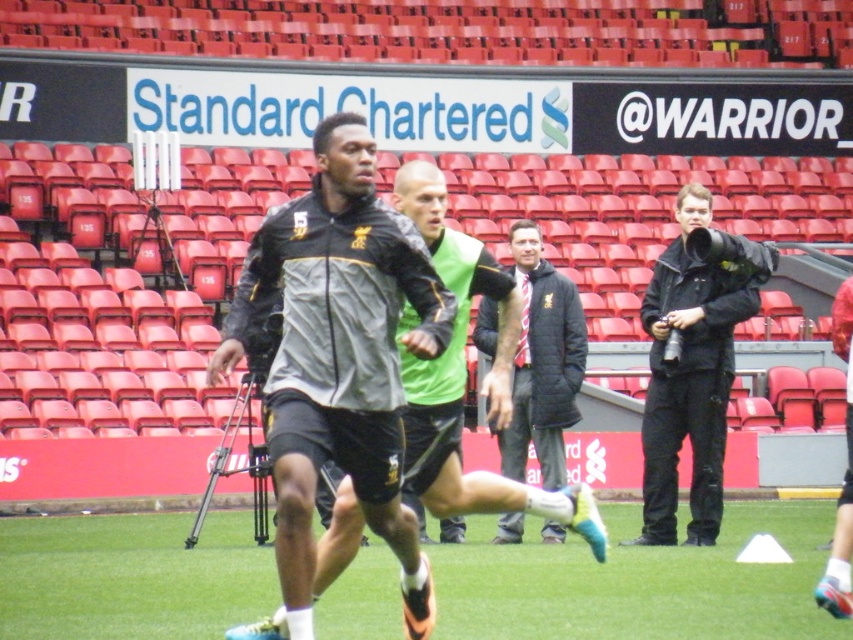
Who is taller, black leather jacket at right or green matte vest at center?

green matte vest at center is taller.

Is black leather jacket at right to the left of green matte vest at center from the viewer's perspective?

In fact, black leather jacket at right is to the right of green matte vest at center.

I want to click on black leather jacket at right, so click(x=689, y=378).

Between green grass at center and green matte vest at center, which one has more height?

green matte vest at center

Is green grass at center thinner than green matte vest at center?

No, green grass at center is not thinner than green matte vest at center.

At what (x,y) coordinates should I click in order to perform the action: click on green grass at center. Please return your answer as a coordinate pair (x, y). Looking at the image, I should click on (640, 582).

Who is taller, dark gray jacket at center or green matte vest at center?

green matte vest at center is taller.

Describe the element at coordinates (543, 362) in the screenshot. The height and width of the screenshot is (640, 853). I see `dark gray jacket at center` at that location.

Is point (544, 483) positioned behind point (421, 220)?

That is True.

The image size is (853, 640). What are the coordinates of `dark gray jacket at center` in the screenshot? It's located at (543, 362).